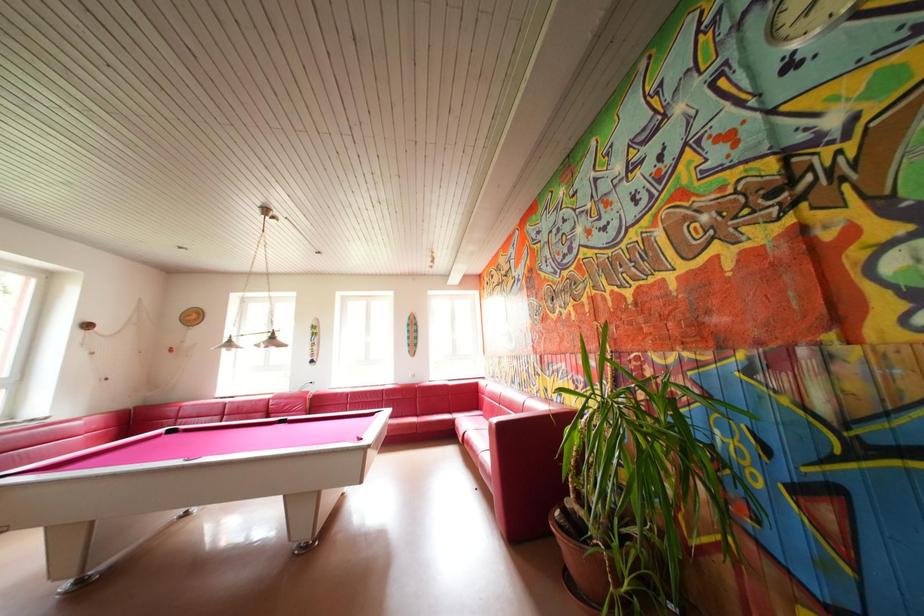
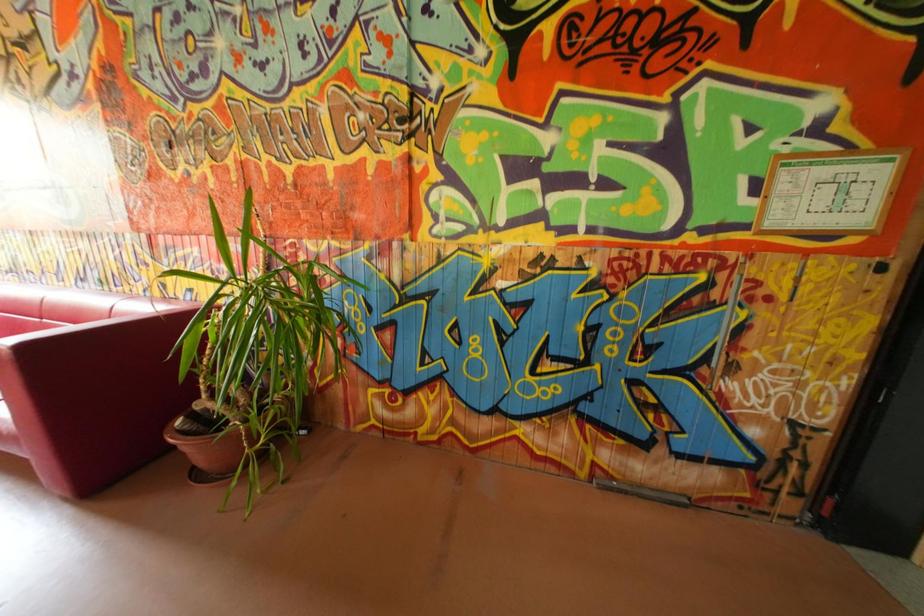
Question: Based on the continuous images, in which direction is the camera rotating? Reply with the corresponding letter.

Choices:
 (A) Left
 (B) Right
 (C) Up
 (D) Down

Answer: (B)